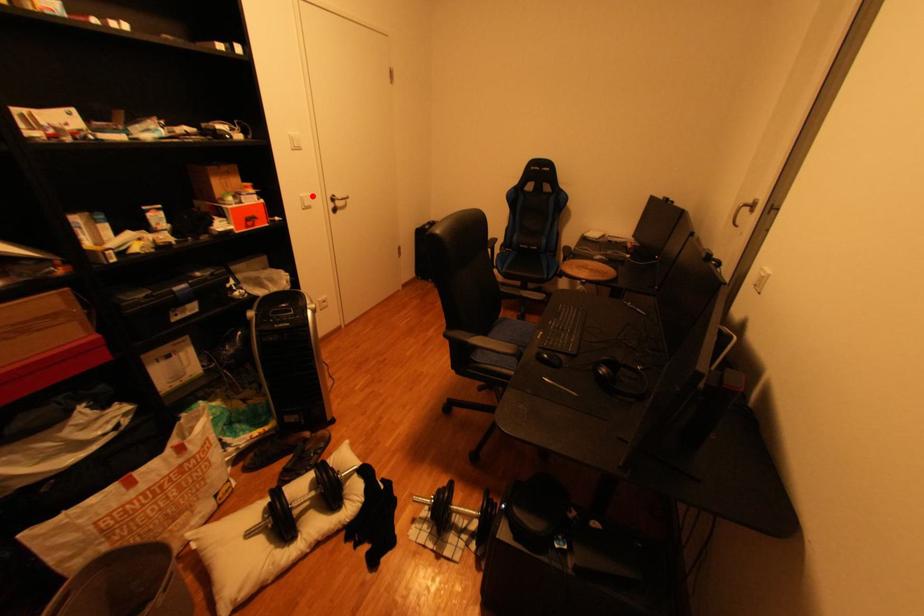
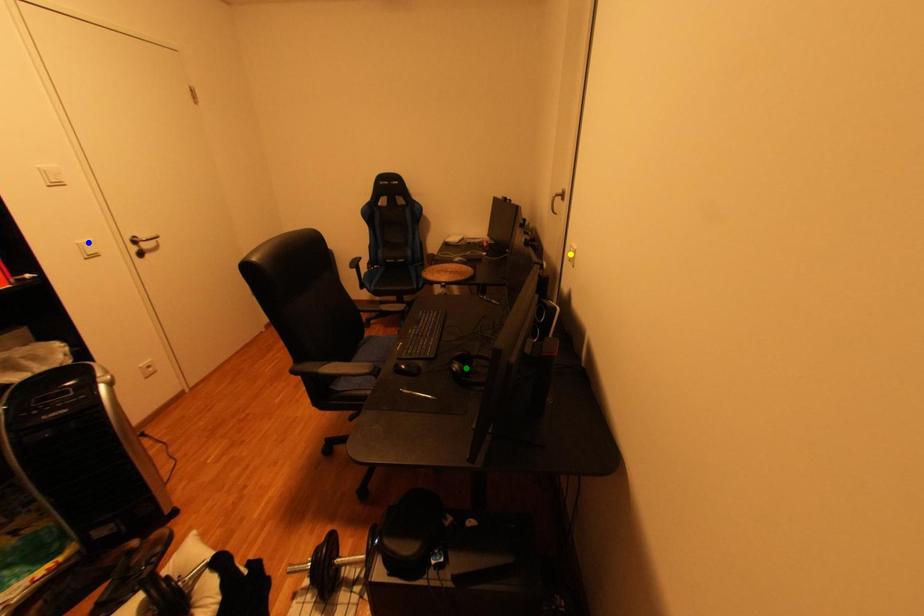
Question: I am providing you with two images of the same scene from different viewpoints. A red point is marked on the first image. You are given multiple points on the second image. Which point in image 2 is actually the same real-world point as the red point in image 1?

Choices:
 (A) blue point
 (B) green point
 (C) yellow point

Answer: (A)